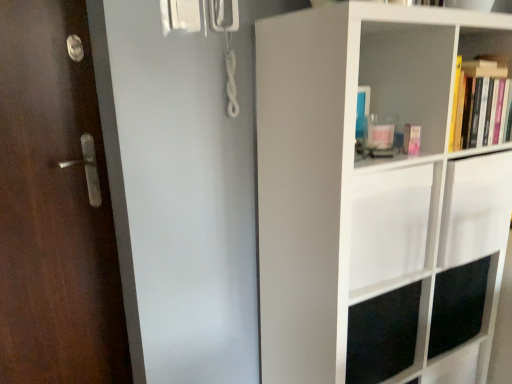
Question: Considering the relative sizes of hardcover books at upper right, positioned as the 1th shelf in top-to-bottom order, and white matte shelf at right, which ranks as the 1th shelf in bottom-to-top order, in the image provided, is hardcover books at upper right, positioned as the 1th shelf in top-to-bottom order, thinner than white matte shelf at right, which ranks as the 1th shelf in bottom-to-top order,?

Choices:
 (A) yes
 (B) no

Answer: (A)

Question: From the image's perspective, is hardcover books at upper right, positioned as the 2th shelf in bottom-to-top order, on white matte shelf at right, which ranks as the 1th shelf in bottom-to-top order?

Choices:
 (A) no
 (B) yes

Answer: (B)

Question: Is hardcover books at upper right, positioned as the 2th shelf in bottom-to-top order, outside white matte shelf at right, positioned as the second shelf in top-to-bottom order?

Choices:
 (A) no
 (B) yes

Answer: (A)

Question: Is hardcover books at upper right, positioned as the 1th shelf in top-to-bottom order, taller than white matte shelf at right, which ranks as the 1th shelf in bottom-to-top order?

Choices:
 (A) no
 (B) yes

Answer: (A)

Question: Is hardcover books at upper right, positioned as the 2th shelf in bottom-to-top order, touching white matte shelf at right, which ranks as the 1th shelf in bottom-to-top order?

Choices:
 (A) yes
 (B) no

Answer: (B)

Question: Is hardcover books at upper right, positioned as the 2th shelf in bottom-to-top order, oriented away from white matte shelf at right, which ranks as the 1th shelf in bottom-to-top order?

Choices:
 (A) no
 (B) yes

Answer: (B)

Question: Is white matte shelf at right, which ranks as the 1th shelf in bottom-to-top order, taller than hardcover books at upper right, positioned as the 1th shelf in top-to-bottom order?

Choices:
 (A) yes
 (B) no

Answer: (A)

Question: From the image's perspective, is white matte shelf at right, positioned as the second shelf in top-to-bottom order, beneath hardcover books at upper right, positioned as the 1th shelf in top-to-bottom order?

Choices:
 (A) yes
 (B) no

Answer: (A)

Question: Is white matte shelf at right, positioned as the second shelf in top-to-bottom order, oriented away from hardcover books at upper right, positioned as the 1th shelf in top-to-bottom order?

Choices:
 (A) yes
 (B) no

Answer: (A)

Question: Does white matte shelf at right, positioned as the second shelf in top-to-bottom order, have a smaller size compared to hardcover books at upper right, positioned as the 2th shelf in bottom-to-top order?

Choices:
 (A) no
 (B) yes

Answer: (A)

Question: Is white matte shelf at right, positioned as the second shelf in top-to-bottom order, not close to hardcover books at upper right, positioned as the 1th shelf in top-to-bottom order?

Choices:
 (A) no
 (B) yes

Answer: (A)

Question: Is white matte shelf at right, which ranks as the 1th shelf in bottom-to-top order, positioned before hardcover books at upper right, positioned as the 1th shelf in top-to-bottom order?

Choices:
 (A) no
 (B) yes

Answer: (B)

Question: Is dark wood door at left turned away from hardcover books at upper right, positioned as the 1th shelf in top-to-bottom order?

Choices:
 (A) yes
 (B) no

Answer: (B)